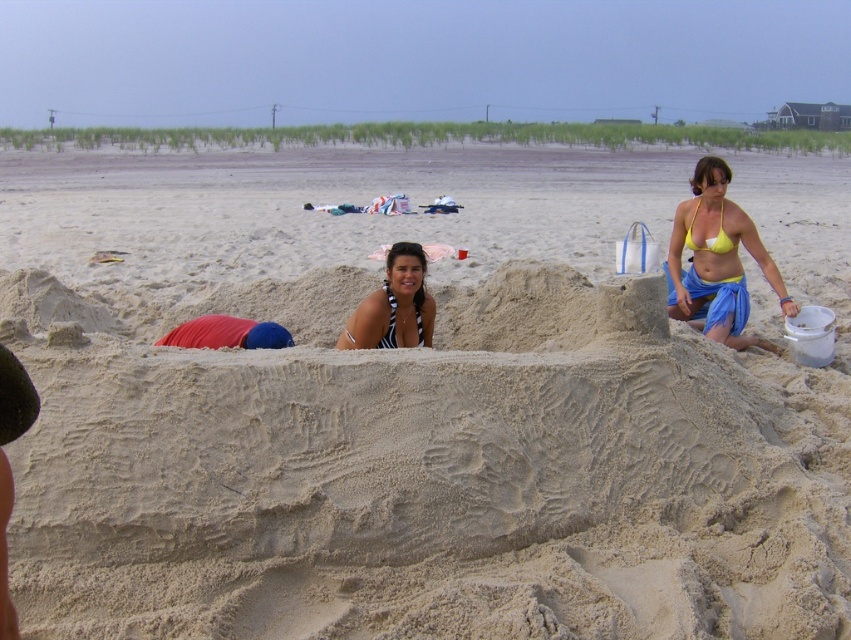
Question: Among these objects, which one is farthest from the camera?

Choices:
 (A) yellow bikini top at upper right
 (B) black striped bikini top at center

Answer: (A)

Question: Which point is closer to the camera taking this photo?

Choices:
 (A) (686, 230)
 (B) (369, 312)

Answer: (B)

Question: Considering the real-world distances, which object is farthest from the black striped bikini top at center?

Choices:
 (A) yellow bikini top at upper right
 (B) yellow matte bikini top at upper center

Answer: (A)

Question: Can you confirm if black striped bikini top at center is wider than yellow matte bikini top at upper center?

Choices:
 (A) no
 (B) yes

Answer: (B)

Question: Can you confirm if yellow bikini top at upper right is wider than black striped bikini top at center?

Choices:
 (A) yes
 (B) no

Answer: (A)

Question: Does yellow bikini top at upper right have a smaller size compared to black striped bikini top at center?

Choices:
 (A) yes
 (B) no

Answer: (B)